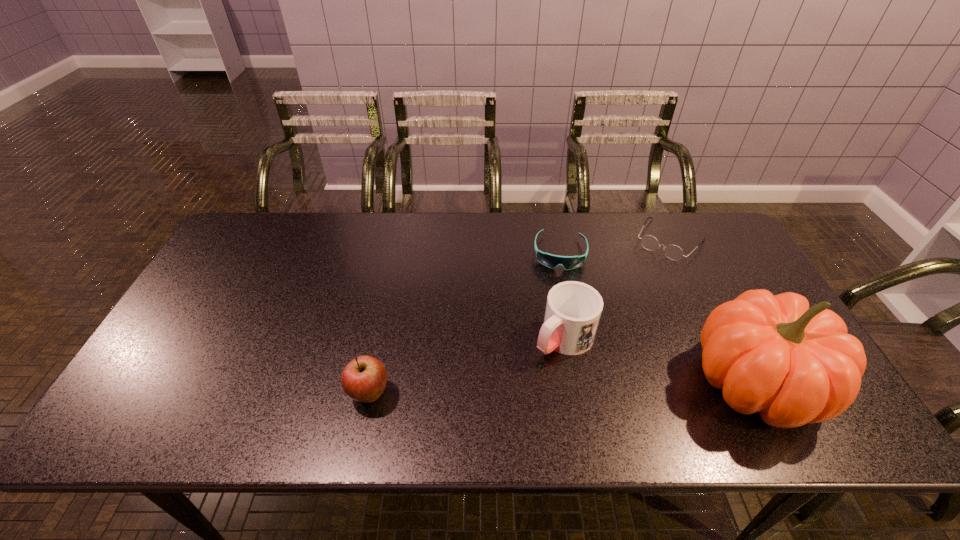
Identify the location of object that is the closest to the mug. (551, 261).

Where is `free space that satisfies the following two spatial constraints: 1. on the front side of the spectacles; 2. on the left side of the pumpkin`? Image resolution: width=960 pixels, height=540 pixels. free space that satisfies the following two spatial constraints: 1. on the front side of the spectacles; 2. on the left side of the pumpkin is located at coordinates (739, 382).

Where is `blank space that satisfies the following two spatial constraints: 1. on the back side of the sunglasses; 2. on the left side of the spectacles`? blank space that satisfies the following two spatial constraints: 1. on the back side of the sunglasses; 2. on the left side of the spectacles is located at coordinates (558, 240).